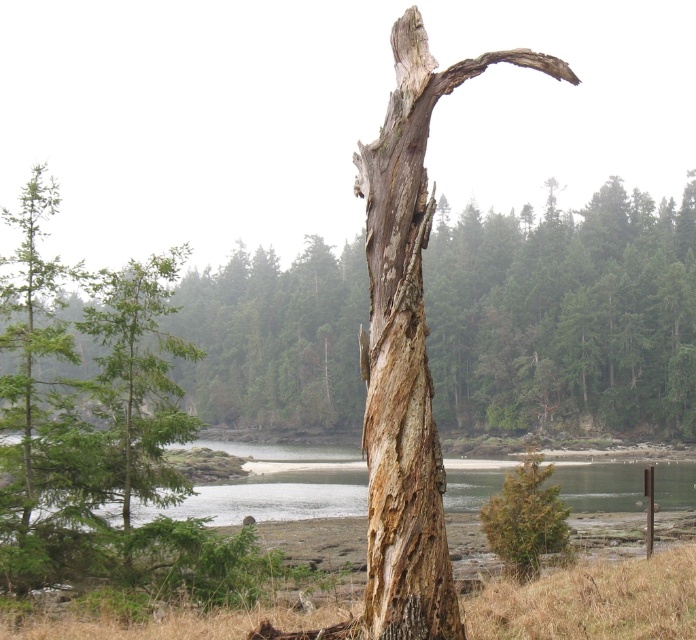
You are standing in the middle of the forest and see the brown textured wood at center. If you walk straight ahead, will you eventually reach the dense forest of coniferous trees in the background?

Yes, because the dense forest of coniferous trees in the background is behind the brown textured wood at center, so walking straight ahead would lead towards them.

You are an environmental scientist examining the image. You need to determine the spatial relationship between the dry grass at center and the brown rough tree at lower right. Which object is positioned higher in the image?

The dry grass at center is located above the brown rough tree at lower right, so the dry grass at center is positioned higher in the image.